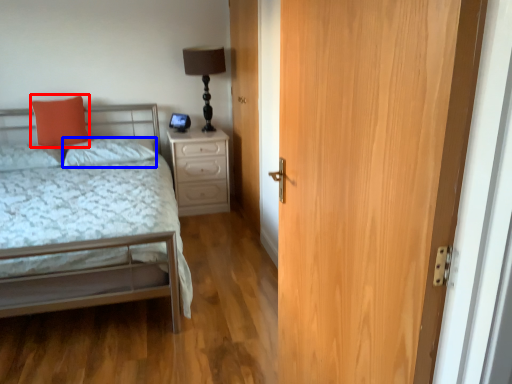
Question: Which object appears farthest to the camera in this image, pillow (highlighted by a red box) or pillow (highlighted by a blue box)?

Choices:
 (A) pillow
 (B) pillow

Answer: (A)